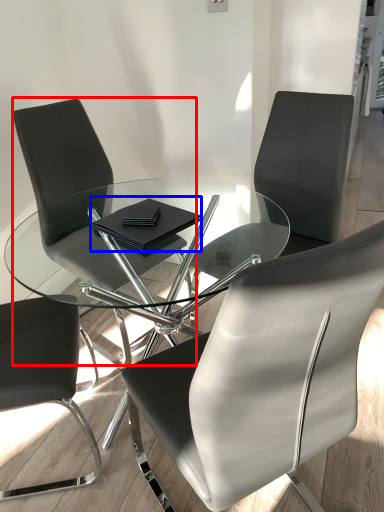
Question: Which point is closer to the camera, chair (highlighted by a red box) or notebook (highlighted by a blue box)?

Choices:
 (A) chair
 (B) notebook

Answer: (B)